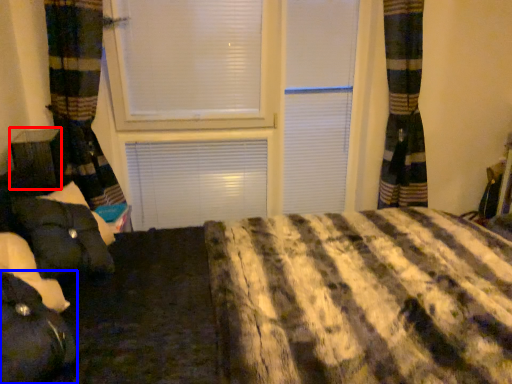
Question: Which of the following is the closest to the observer, furniture (highlighted by a red box) or bean bag chair (highlighted by a blue box)?

Choices:
 (A) furniture
 (B) bean bag chair

Answer: (B)